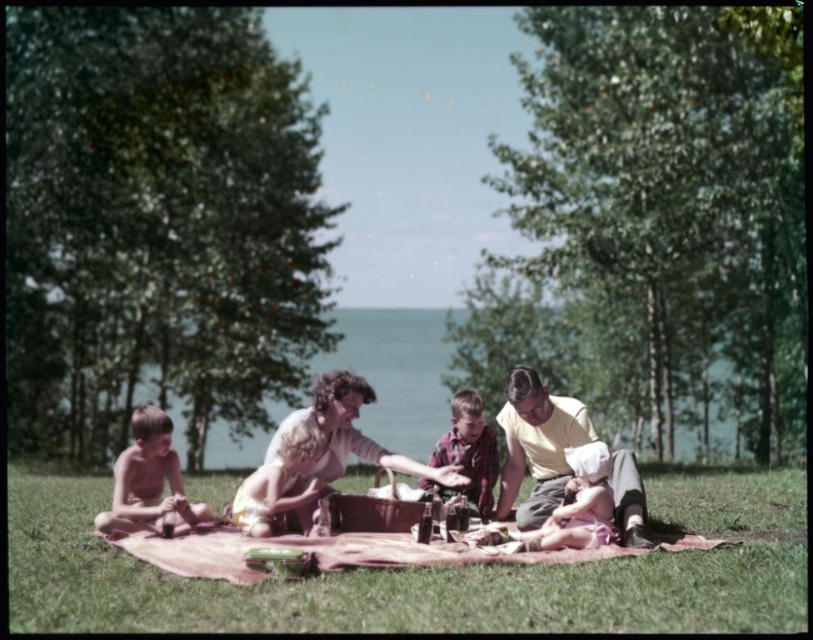
Consider the image. What is the 2D coordinate of the matte pink blanket at center in the image?

The matte pink blanket at center is located at the 2D coordinate point of [342,458].

You are a photographer trying to capture a photo of the matte yellow shirt at center. You need to ensure that the matte pink blanket at center does not block the view. Based on the scene description, can you determine if the blanket is wider than the shirt?

The matte pink blanket at center might be wider than matte yellow shirt at center, so there is a possibility that the blanket could block the view of the shirt. To ensure the shirt is visible, adjust the camera angle or position to avoid the blanket obstructing it.